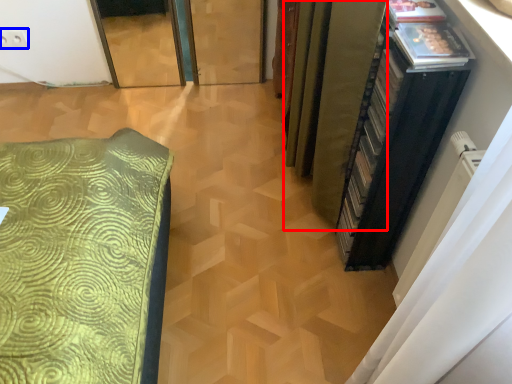
Question: Which of the following is the farthest to the observer, curtain (highlighted by a red box) or electric outlet (highlighted by a blue box)?

Choices:
 (A) curtain
 (B) electric outlet

Answer: (B)